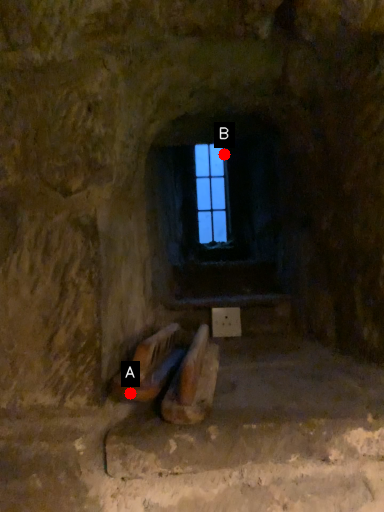
Question: Two points are circled on the image, labeled by A and B beside each circle. Which point is farther to the camera?

Choices:
 (A) A is further
 (B) B is further

Answer: (B)